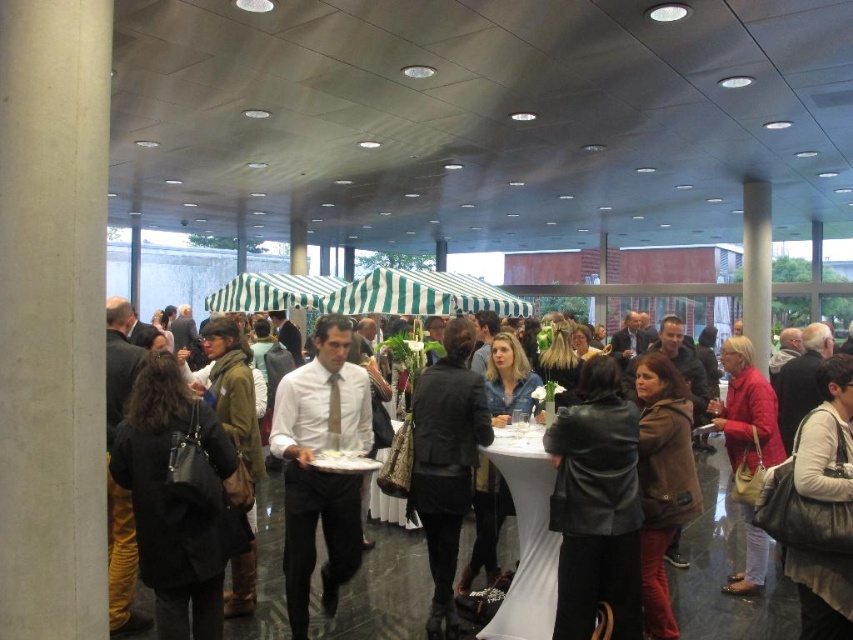
Question: Is white shirt at center behind white fabric table at center?

Choices:
 (A) no
 (B) yes

Answer: (B)

Question: Is white shirt at center smaller than white fabric table at center?

Choices:
 (A) no
 (B) yes

Answer: (B)

Question: Is the position of white shirt at center more distant than that of white fabric table at center?

Choices:
 (A) no
 (B) yes

Answer: (B)

Question: Which point is closer to the camera?

Choices:
 (A) white fabric table at center
 (B) white shirt at center

Answer: (A)

Question: Which of the following is the farthest from the observer?

Choices:
 (A) white fabric table at center
 (B) white shirt at center

Answer: (B)

Question: Which point is farther to the camera?

Choices:
 (A) white shirt at center
 (B) white fabric table at center

Answer: (A)